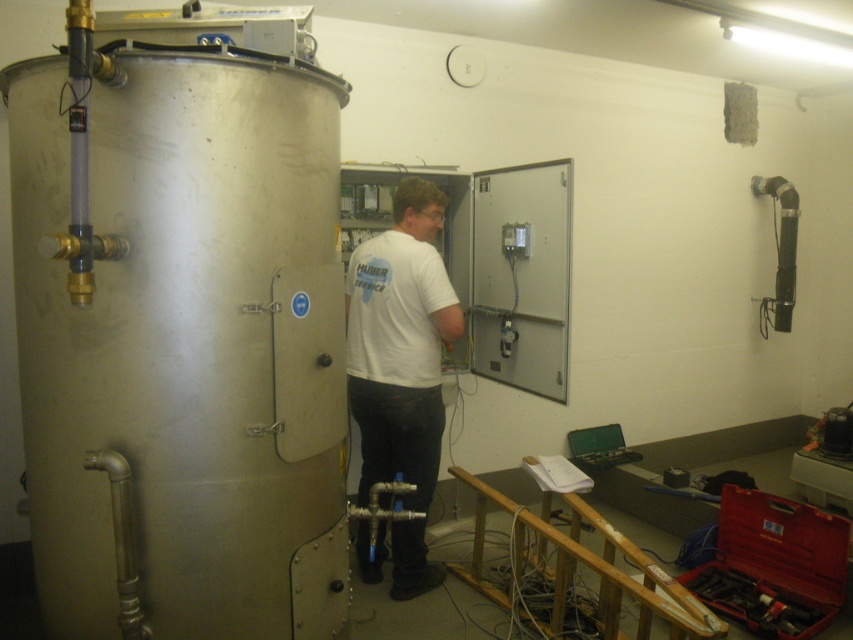
Does white matte shirt at center have a smaller size compared to metallic toolbox at lower right?

Incorrect, white matte shirt at center is not smaller in size than metallic toolbox at lower right.

Is white matte shirt at center bigger than metallic toolbox at lower right?

Indeed, white matte shirt at center has a larger size compared to metallic toolbox at lower right.

This screenshot has width=853, height=640. Identify the location of white matte shirt at center. (399, 342).

Which is in front, point (230, 145) or point (375, 420)?

Positioned in front is point (230, 145).

Is polished metallic water heater at left further to the viewer compared to white matte shirt at center?

No, it is in front of white matte shirt at center.

At what (x,y) coordinates should I click in order to perform the action: click on polished metallic water heater at left. Please return your answer as a coordinate pair (x, y). The height and width of the screenshot is (640, 853). Looking at the image, I should click on (178, 337).

Can you confirm if polished metallic water heater at left is positioned above metallic toolbox at lower right?

Indeed, polished metallic water heater at left is positioned over metallic toolbox at lower right.

What do you see at coordinates (178, 337) in the screenshot? I see `polished metallic water heater at left` at bounding box center [178, 337].

The height and width of the screenshot is (640, 853). What are the coordinates of `polished metallic water heater at left` in the screenshot? It's located at (178, 337).